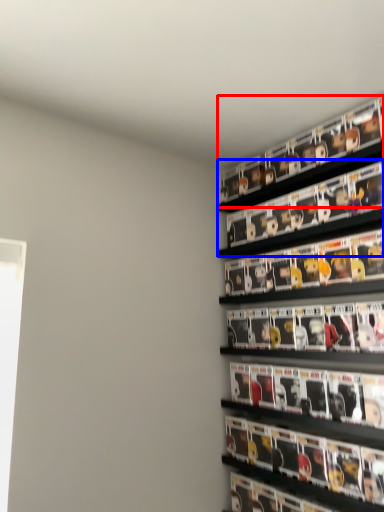
Question: Which object appears closest to the camera in this image, shelf (highlighted by a red box) or shelf (highlighted by a blue box)?

Choices:
 (A) shelf
 (B) shelf

Answer: (B)